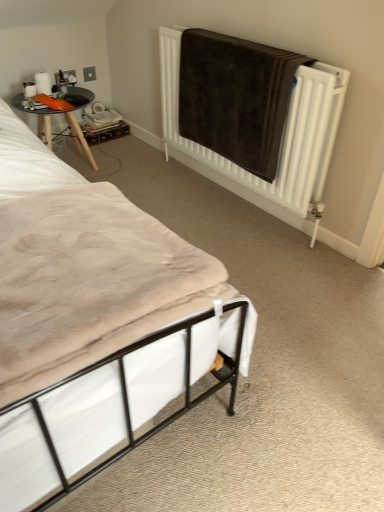
What do you see at coordinates (282, 133) in the screenshot?
I see `brown towel at upper right` at bounding box center [282, 133].

Locate an element on the screen. The height and width of the screenshot is (512, 384). brown towel at upper right is located at coordinates (282, 133).

Where is `white fabric bed at lower left`? white fabric bed at lower left is located at coordinates (94, 274).

The width and height of the screenshot is (384, 512). What are the coordinates of `brown towel at upper right` in the screenshot? It's located at (282, 133).

This screenshot has width=384, height=512. I want to click on radiator below the wooden table at left (from the image's perspective), so click(282, 133).

Does brown towel at upper right have a lesser height compared to wooden table at left?

In fact, brown towel at upper right may be taller than wooden table at left.

What's the angular difference between brown towel at upper right and wooden table at left's facing directions?

The angular difference between brown towel at upper right and wooden table at left is 90.7 degrees.

Consider the image. From a real-world perspective, who is located higher, brown towel at upper right or wooden table at left?

From a 3D spatial view, brown towel at upper right is above.

Is beige fabric mattress at lower left at the right side of wooden table at left?

Indeed, beige fabric mattress at lower left is positioned on the right side of wooden table at left.

How different are the orientations of beige fabric mattress at lower left and wooden table at left in degrees?

The angle between the facing direction of beige fabric mattress at lower left and the facing direction of wooden table at left is 0.742 degrees.

Considering the relative sizes of beige fabric mattress at lower left and wooden table at left in the image provided, is beige fabric mattress at lower left smaller than wooden table at left?

Indeed, beige fabric mattress at lower left has a smaller size compared to wooden table at left.

Does beige fabric mattress at lower left have a greater width compared to wooden table at left?

Yes, beige fabric mattress at lower left is wider than wooden table at left.

From the image's perspective, is white fabric bed at lower left above or below wooden table at left?

white fabric bed at lower left is below wooden table at left.

From a real-world perspective, which is physically below, white fabric bed at lower left or wooden table at left?

white fabric bed at lower left is physically lower.

Is wooden table at left a part of white fabric bed at lower left?

No, wooden table at left is not a part of white fabric bed at lower left.

Is beige fabric mattress at lower left positioned with its back to white fabric bed at lower left?

No, beige fabric mattress at lower left is not facing the opposite direction of white fabric bed at lower left.

From a real-world perspective, does beige fabric mattress at lower left stand above white fabric bed at lower left?

Correct, in the physical world, beige fabric mattress at lower left is higher than white fabric bed at lower left.

In the image, is beige fabric mattress at lower left on the left side or the right side of white fabric bed at lower left?

In the image, beige fabric mattress at lower left appears on the right side of white fabric bed at lower left.

Between beige fabric mattress at lower left and white fabric bed at lower left, which one has larger width?

white fabric bed at lower left is wider.

Who is bigger, beige fabric mattress at lower left or brown towel at upper right?

brown towel at upper right is bigger.

What are the coordinates of `radiator behind the beige fabric mattress at lower left` in the screenshot? It's located at (282, 133).

Is beige fabric mattress at lower left positioned far away from brown towel at upper right?

That's right, there is a large distance between beige fabric mattress at lower left and brown towel at upper right.

Which is more to the left, beige fabric mattress at lower left or brown towel at upper right?

beige fabric mattress at lower left is more to the left.

From the image's perspective, is brown towel at upper right above beige fabric mattress at lower left?

Yes, from the image's perspective, brown towel at upper right is over beige fabric mattress at lower left.

Could you tell me if brown towel at upper right is facing beige fabric mattress at lower left?

Yes, brown towel at upper right is aimed at beige fabric mattress at lower left.

From a real-world perspective, between brown towel at upper right and beige fabric mattress at lower left, who is vertically lower?

brown towel at upper right.

Between brown towel at upper right and beige fabric mattress at lower left, which one is positioned behind?

brown towel at upper right is further away from the camera.

Is white fabric bed at lower left touching brown towel at upper right?

No.

From the image's perspective, between white fabric bed at lower left and brown towel at upper right, which one is located above?

brown towel at upper right appears higher in the image.

What's the angular difference between white fabric bed at lower left and brown towel at upper right's facing directions?

The angle between the facing direction of white fabric bed at lower left and the facing direction of brown towel at upper right is 179 degrees.

Is white fabric bed at lower left positioned in front of brown towel at upper right?

Yes, it is.

Locate an element on the screen. The image size is (384, 512). radiator located below the wooden table at left (from the image's perspective) is located at coordinates (282, 133).

Find the location of a particular element. The height and width of the screenshot is (512, 384). table behind the beige fabric mattress at lower left is located at coordinates (68, 121).

Which object lies further to the anchor point beige fabric mattress at lower left, brown towel at upper right or white fabric bed at lower left?

brown towel at upper right is positioned further to the anchor beige fabric mattress at lower left.

Which object lies nearer to the anchor point wooden table at left, white fabric bed at lower left or beige fabric mattress at lower left?

white fabric bed at lower left lies closer to wooden table at left than the other object.

Based on the photo, which object lies further to the anchor point wooden table at left, beige fabric mattress at lower left or white fabric bed at lower left?

beige fabric mattress at lower left is further to wooden table at left.

In the scene shown: Based on their spatial positions, is white fabric bed at lower left or brown towel at upper right further from wooden table at left?

The object further to wooden table at left is white fabric bed at lower left.

Looking at the image, which one is located further to wooden table at left, brown towel at upper right or white fabric bed at lower left?

Based on the image, white fabric bed at lower left appears to be further to wooden table at left.

Based on their spatial positions, is brown towel at upper right or beige fabric mattress at lower left further from wooden table at left?

beige fabric mattress at lower left is positioned further to the anchor wooden table at left.

Which object lies nearer to the anchor point white fabric bed at lower left, beige fabric mattress at lower left or wooden table at left?

beige fabric mattress at lower left lies closer to white fabric bed at lower left than the other object.

When comparing their distances from beige fabric mattress at lower left, does white fabric bed at lower left or wooden table at left seem closer?

white fabric bed at lower left lies closer to beige fabric mattress at lower left than the other object.

Locate an element on the screen. The height and width of the screenshot is (512, 384). bed between beige fabric mattress at lower left and wooden table at left along the z-axis is located at coordinates (94, 274).

Locate an element on the screen. The width and height of the screenshot is (384, 512). bed positioned between beige fabric mattress at lower left and brown towel at upper right from near to far is located at coordinates click(94, 274).

Locate an element on the screen. radiator between beige fabric mattress at lower left and wooden table at left from front to back is located at coordinates (282, 133).

Locate an element on the screen. Image resolution: width=384 pixels, height=512 pixels. radiator positioned between white fabric bed at lower left and wooden table at left from near to far is located at coordinates (282, 133).